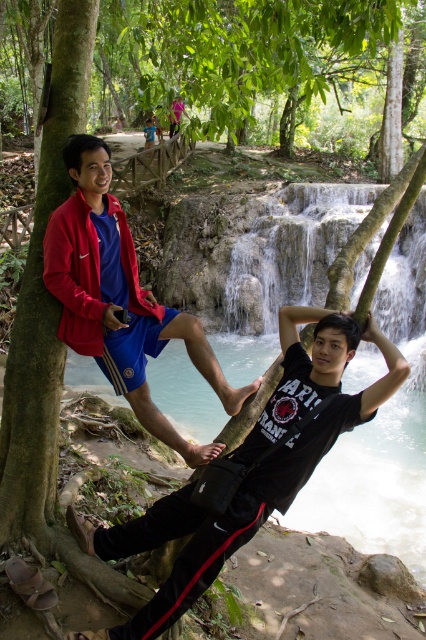
Question: Which of the following is the farthest from the observer?

Choices:
 (A) matte blue shorts at left
 (B) black matte shirt at center

Answer: (A)

Question: Can you confirm if black matte shirt at center is positioned below matte blue shorts at left?

Choices:
 (A) yes
 (B) no

Answer: (A)

Question: Which point is farther from the camera taking this photo?

Choices:
 (A) (74, 268)
 (B) (137, 627)

Answer: (A)

Question: Can you confirm if black matte shirt at center is thinner than matte blue shorts at left?

Choices:
 (A) no
 (B) yes

Answer: (A)

Question: Among these objects, which one is nearest to the camera?

Choices:
 (A) matte blue shorts at left
 (B) black matte shirt at center

Answer: (B)

Question: Is the position of black matte shirt at center less distant than that of matte blue shorts at left?

Choices:
 (A) no
 (B) yes

Answer: (B)